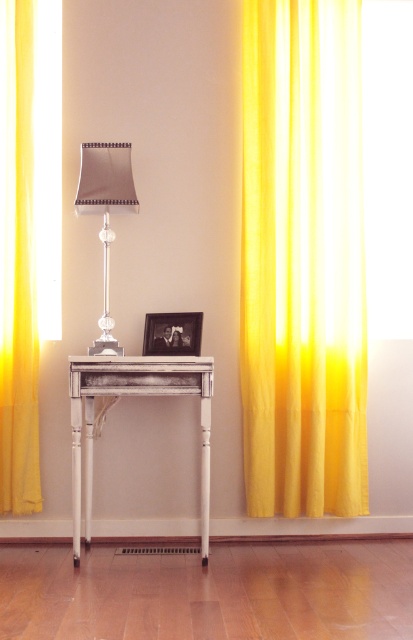
Question: Which object is positioned farthest from the white distressed wood table at center?

Choices:
 (A) yellow sheer curtain at left
 (B) metallic silver table lamp at center
 (C) yellow sheer curtain at right

Answer: (C)

Question: Is yellow sheer curtain at left thinner than metallic silver table lamp at center?

Choices:
 (A) yes
 (B) no

Answer: (A)

Question: Which object is positioned farthest from the yellow sheer curtain at right?

Choices:
 (A) metallic silver table lamp at center
 (B) yellow sheer curtain at left
 (C) translucent yellow curtain at right
 (D) white distressed wood table at center

Answer: (B)

Question: Is yellow sheer curtain at right below yellow sheer curtain at left?

Choices:
 (A) yes
 (B) no

Answer: (B)

Question: Which of these objects is positioned closest to the metallic silver table lamp at center?

Choices:
 (A) translucent yellow curtain at right
 (B) white distressed wood table at center
 (C) yellow sheer curtain at left
 (D) yellow sheer curtain at right

Answer: (C)

Question: Is yellow sheer curtain at left wider than white distressed wood table at center?

Choices:
 (A) yes
 (B) no

Answer: (B)